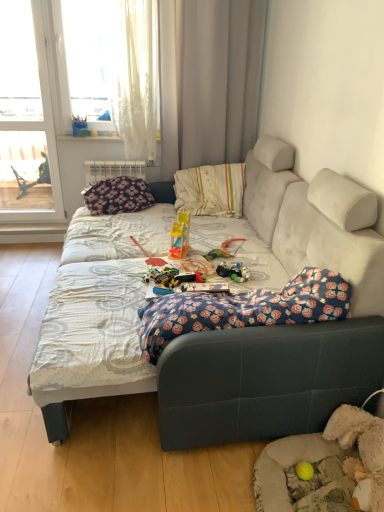
Question: Is translucent plastic toy at center turned away from floral fabric blanket at center?

Choices:
 (A) no
 (B) yes

Answer: (A)

Question: Can you confirm if translucent plastic toy at center is positioned to the left of floral fabric blanket at center?

Choices:
 (A) yes
 (B) no

Answer: (B)

Question: Is translucent plastic toy at center next to floral fabric blanket at center and touching it?

Choices:
 (A) no
 (B) yes

Answer: (A)

Question: From the image's perspective, is translucent plastic toy at center located above floral fabric blanket at center?

Choices:
 (A) yes
 (B) no

Answer: (A)

Question: From a real-world perspective, is translucent plastic toy at center beneath floral fabric blanket at center?

Choices:
 (A) yes
 (B) no

Answer: (A)

Question: From a real-world perspective, is velvet gray couch at center positioned above or below translucent plastic slide at center, which is counted as the second toy, starting from the front?

Choices:
 (A) above
 (B) below

Answer: (B)

Question: From the image's perspective, relative to translucent plastic slide at center, the 1th toy when ordered from back to front, is velvet gray couch at center above or below?

Choices:
 (A) below
 (B) above

Answer: (A)

Question: In terms of height, does velvet gray couch at center look taller or shorter compared to translucent plastic slide at center, the 1th toy when ordered from back to front?

Choices:
 (A) tall
 (B) short

Answer: (A)

Question: Is velvet gray couch at center bigger or smaller than translucent plastic slide at center, the 1th toy when ordered from back to front?

Choices:
 (A) small
 (B) big

Answer: (B)

Question: Considering the positions of point (269, 250) and point (236, 115), is point (269, 250) closer or farther from the camera than point (236, 115)?

Choices:
 (A) closer
 (B) farther

Answer: (A)

Question: In terms of size, does velvet gray couch at center appear bigger or smaller than white fabric curtain at upper center?

Choices:
 (A) big
 (B) small

Answer: (A)

Question: Is velvet gray couch at center inside or outside of white fabric curtain at upper center?

Choices:
 (A) inside
 (B) outside

Answer: (B)

Question: In terms of width, does velvet gray couch at center look wider or thinner when compared to white fabric curtain at upper center?

Choices:
 (A) wide
 (B) thin

Answer: (A)

Question: Is yellow rubber ball at lower right, which appears as the first toy when viewed from the front, bigger or smaller than floral fabric blanket at center?

Choices:
 (A) big
 (B) small

Answer: (B)

Question: Which is correct: yellow rubber ball at lower right, which appears as the second toy when viewed from the top, is inside floral fabric blanket at center, or outside of it?

Choices:
 (A) inside
 (B) outside

Answer: (B)